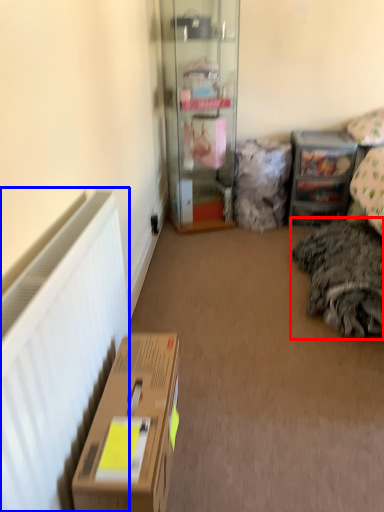
Question: Which object is further to the camera taking this photo, bedding (highlighted by a red box) or radiator (highlighted by a blue box)?

Choices:
 (A) bedding
 (B) radiator

Answer: (A)